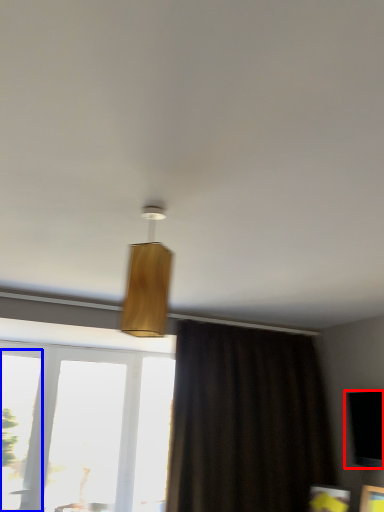
Question: Which object appears farthest to the camera in this image, window screen (highlighted by a red box) or window (highlighted by a blue box)?

Choices:
 (A) window screen
 (B) window

Answer: (B)